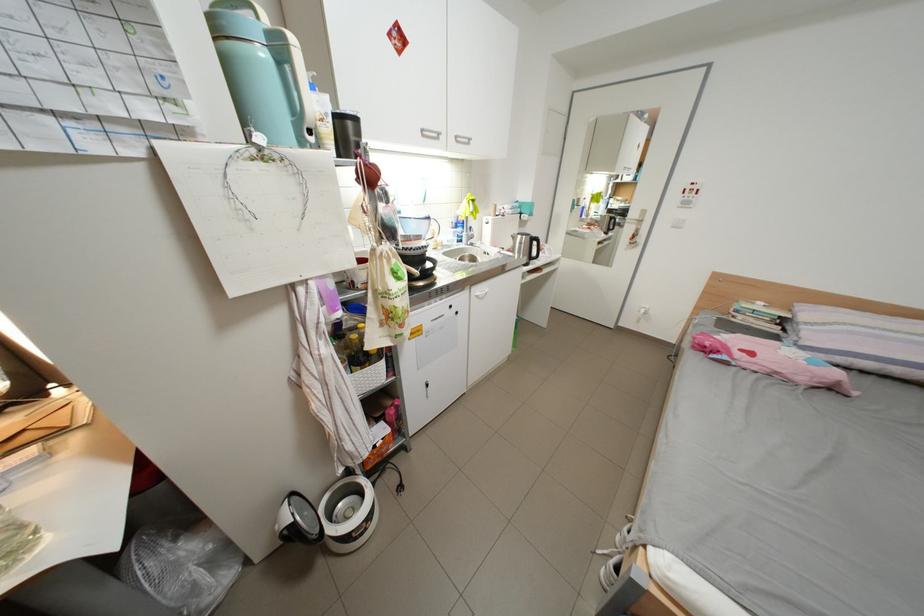
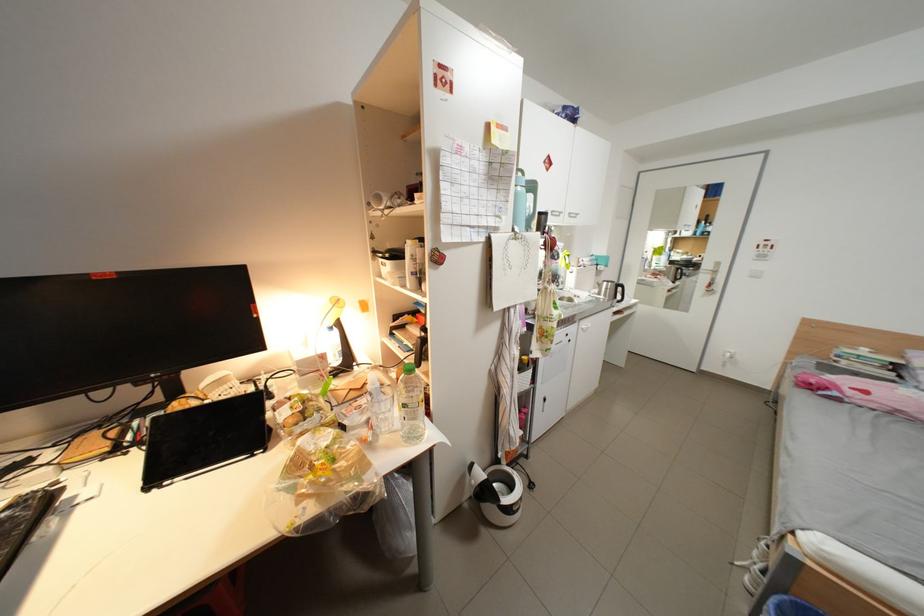
Where in the second image is the point corresponding to point (470, 300) from the first image?

(582, 331)